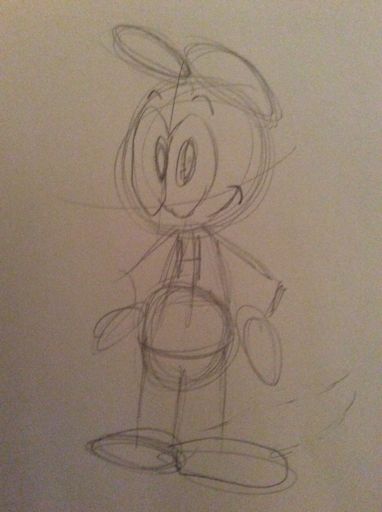
You are a GUI agent. You are given a task and a screenshot of the screen. Output one action in this format:
    pyautogui.click(x=<x>, y=<y>)
    Task: Click on the chest
    This screenshot has width=382, height=512.
    Given the screenshot: What is the action you would take?
    pyautogui.click(x=188, y=253)